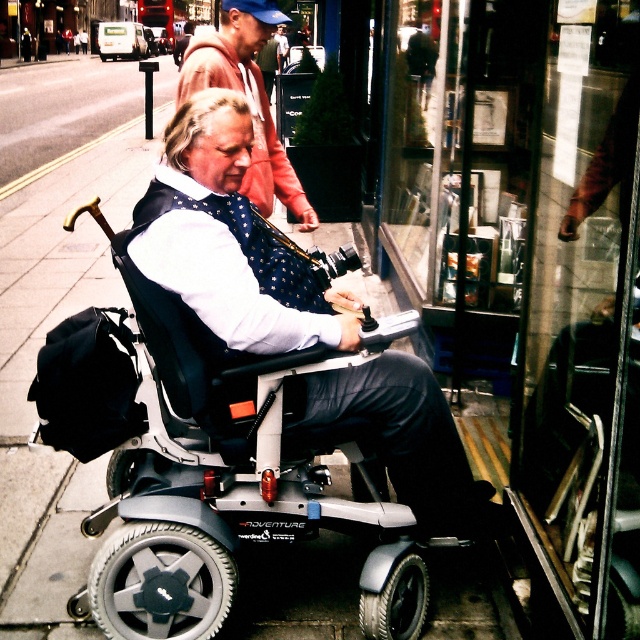
You are a photographer standing in front of the glassy reflective window at center and the polka dot bow tie at center. You want to take a photo of the reflection in the window. Which object should you focus on to capture the reflection?

The glassy reflective window at center is located above the polka dot bow tie at center, so to capture the reflection, you should focus on the glassy reflective window at center since it is the reflective surface.

You are standing on the sidewalk in the image and want to take a photo of the man in the electric wheelchair labeled ADVENTURE. The camera you have can only focus on objects within 5 meters. Will the point at coordinates [445,124] be in focus?

The point at coordinates [445,124] is 4.03 meters from the viewer, which is within the 5 meters focus range of the camera. Therefore, the point will be in focus.

You are a photographer trying to capture a clear shot of the matte black wheelchair at center and the polka dot bow tie at center. Which object should you focus on first to ensure depth of field captures both subjects?

The matte black wheelchair at center is closer to the viewer than the polka dot bow tie at center. To ensure both are in focus, focus on the polka dot bow tie at center first since it is farther away, as depth of field extends beyond the focal point more effectively.